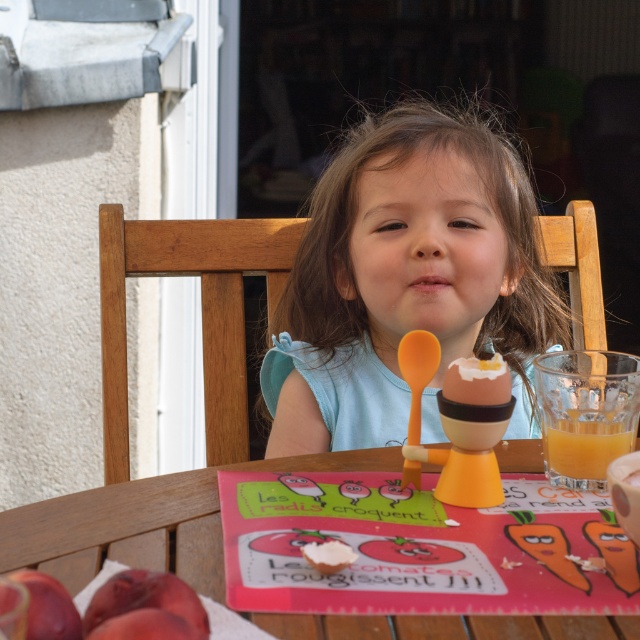
Who is positioned more to the right, matte blue shirt at center or wooden table at center?

matte blue shirt at center is more to the right.

Which is behind, point (480, 320) or point (108, 509)?

The point (480, 320) is behind.

Is point (522, 289) farther from camera compared to point (509, 636)?

Yes.

This screenshot has height=640, width=640. Identify the location of matte blue shirt at center. (404, 278).

Is matte blue shirt at center to the left of translucent glass cup at right from the viewer's perspective?

Yes, matte blue shirt at center is to the left of translucent glass cup at right.

Who is more forward, (x=317, y=420) or (x=572, y=461)?

Point (x=572, y=461) is more forward.

Where is `matte blue shirt at center`? This screenshot has height=640, width=640. matte blue shirt at center is located at coordinates coord(404,278).

Who is lower down, wooden table at center or translucent glass cup at right?

wooden table at center

Is wooden table at center further to camera compared to translucent glass cup at right?

No.

Is point (184, 497) behind point (579, 435)?

No, it is in front of (579, 435).

Locate an element on the screen. This screenshot has height=640, width=640. wooden table at center is located at coordinates (147, 522).